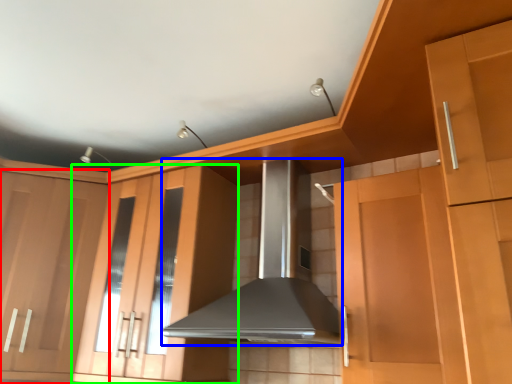
Question: Which is nearer to the cabinetry (highlighted by a red box)? home appliance (highlighted by a blue box) or cabinetry (highlighted by a green box).

Choices:
 (A) home appliance
 (B) cabinetry

Answer: (B)